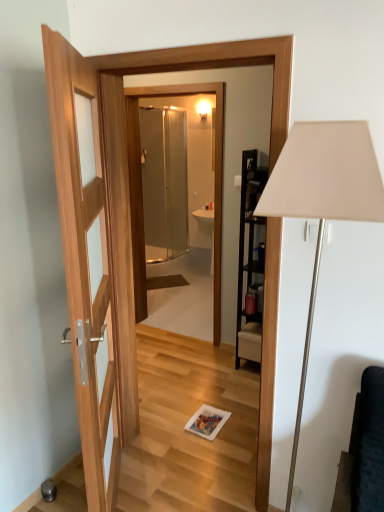
Question: Considering the positions of transparent glass shower at center and white matte floor lamp at right in the image, is transparent glass shower at center wider or thinner than white matte floor lamp at right?

Choices:
 (A) wide
 (B) thin

Answer: (B)

Question: From the image's perspective, is transparent glass shower at center positioned above or below white matte floor lamp at right?

Choices:
 (A) above
 (B) below

Answer: (A)

Question: Which is nearer to the transparent glass shower at center?

Choices:
 (A) clear glass shower door at center
 (B) white matte floor lamp at right

Answer: (A)

Question: Which object is the farthest from the transparent glass shower at center?

Choices:
 (A) clear glass shower door at center
 (B) white matte floor lamp at right

Answer: (B)